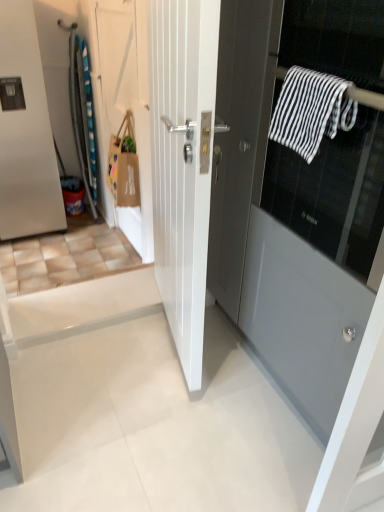
Question: From the image's perspective, is white glossy door at center, the 3th door from the left, above or below satin silver refrigerator at left, the first door when ordered from left to right?

Choices:
 (A) above
 (B) below

Answer: (B)

Question: Is white glossy door at center, the 3th door from the left, to the left or to the right of satin silver refrigerator at left, which is the 4th door from right to left, in the image?

Choices:
 (A) left
 (B) right

Answer: (B)

Question: Which is nearer to the white matte door at upper left, placed as the 2th door when sorted from left to right?

Choices:
 (A) brown paper bag at upper left
 (B) matte gray door at center, which is the first door in right-to-left order
 (C) white glossy door at center, the 3th door from the left
 (D) black and white striped towel at upper right
 (E) satin silver refrigerator at left, the first door when ordered from left to right

Answer: (A)

Question: Which of these objects is positioned closest to the black and white striped towel at upper right?

Choices:
 (A) white glossy door at center, the 3th door from the left
 (B) white matte door at upper left, placed as the 2th door when sorted from left to right
 (C) matte gray door at center, the 4th door positioned from the left
 (D) brown paper bag at upper left
 (E) satin silver refrigerator at left, which is the 4th door from right to left

Answer: (C)